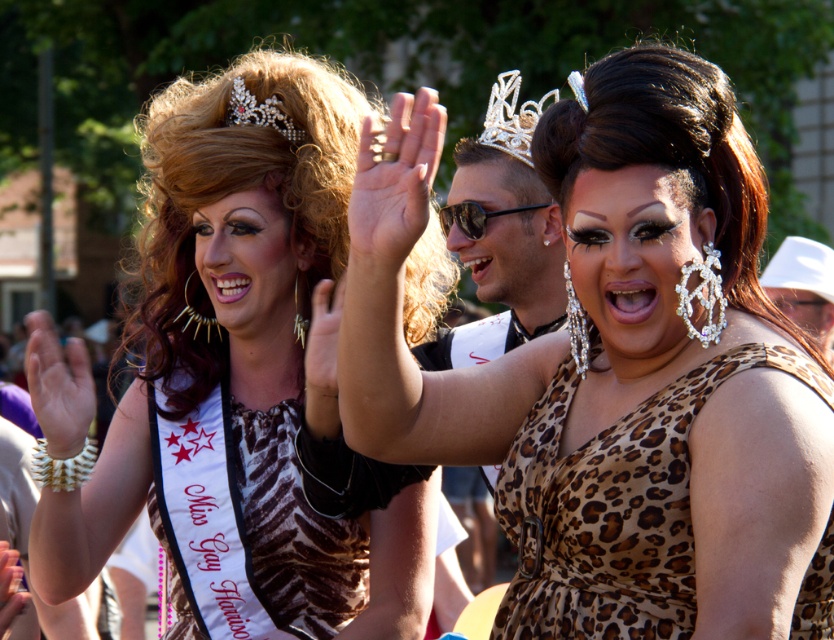
Question: Which point is closer to the camera?

Choices:
 (A) silver/crystal tiara at upper center
 (B) leopard print dress at center
 (C) leopard print fabric dress at center
 (D) black reflective sunglasses at center

Answer: (B)

Question: Does zebra print dress at center have a larger size compared to pearl/sparkly tiara at upper left?

Choices:
 (A) yes
 (B) no

Answer: (A)

Question: Among these objects, which one is nearest to the camera?

Choices:
 (A) pearl/sparkly tiara at upper left
 (B) leopard print dress at center
 (C) leopard print fabric dress at center

Answer: (B)

Question: Based on their relative distances, which object is farther from the leopard print dress at center?

Choices:
 (A) pearl/sparkly tiara at upper left
 (B) silver/crystal tiara at upper center
 (C) zebra print dress at center
 (D) black reflective sunglasses at center

Answer: (D)

Question: Is leopard print fabric dress at center positioned in front of pearl/sparkly tiara at upper left?

Choices:
 (A) yes
 (B) no

Answer: (A)

Question: Does leopard print fabric dress at center have a greater width compared to pearl/sparkly tiara at upper left?

Choices:
 (A) no
 (B) yes

Answer: (B)